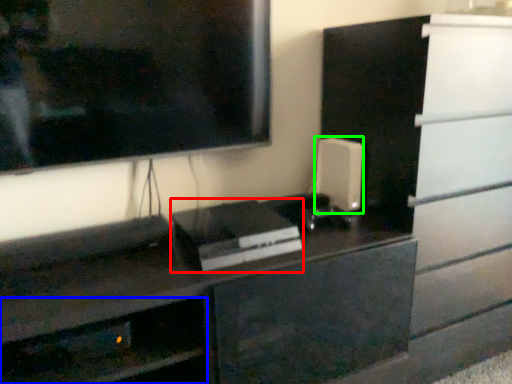
Question: Based on their relative distances, which object is farther from appliance (highlighted by a red box)? Choose from shelf (highlighted by a blue box) and appliance (highlighted by a green box).

Choices:
 (A) shelf
 (B) appliance

Answer: (A)